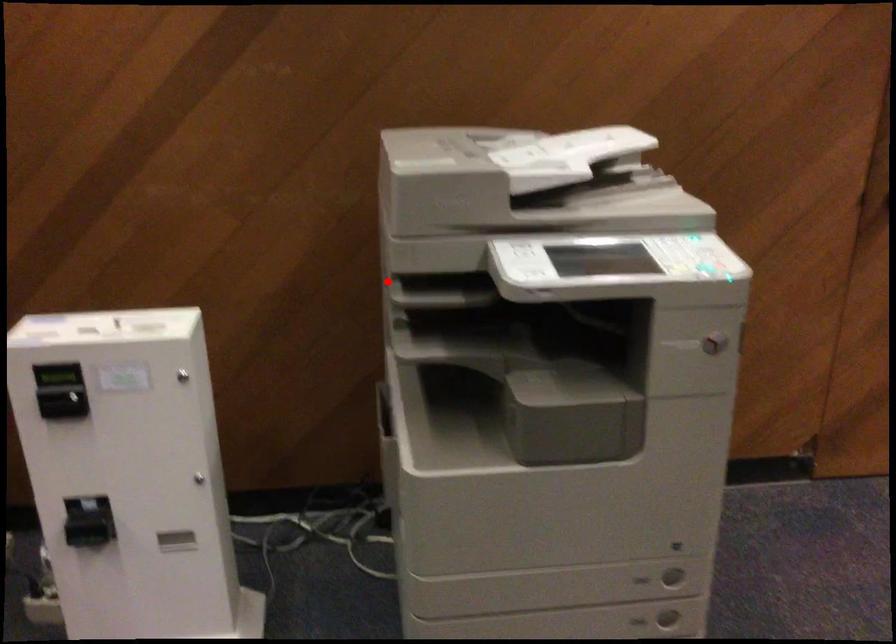
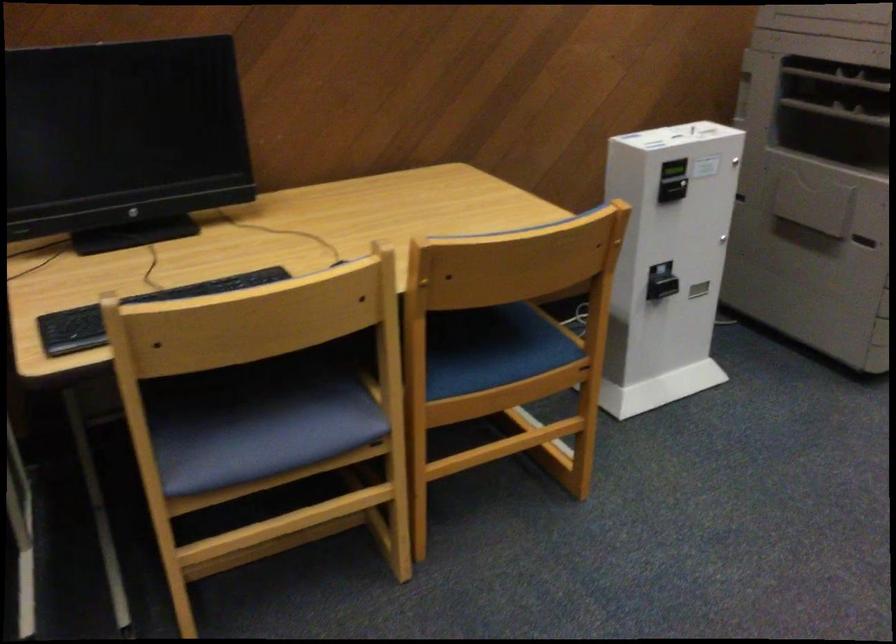
Question: I am providing you with two images of the same scene from different viewpoints. Given a red point in image1, look at the same physical point in image2. Is it:

Choices:
 (A) Closer to the viewpoint
 (B) Farther from the viewpoint

Answer: (B)